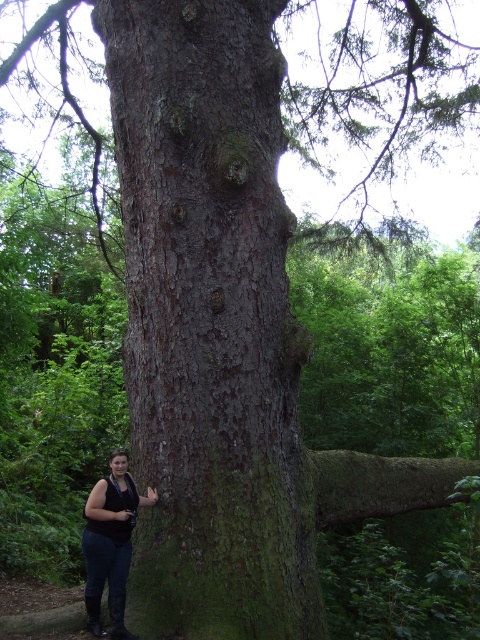
Question: Does dark brown rough bark at center lie in front of matte black vest at lower left?

Choices:
 (A) yes
 (B) no

Answer: (A)

Question: Can you confirm if dark brown rough bark at center is wider than matte black vest at lower left?

Choices:
 (A) yes
 (B) no

Answer: (A)

Question: Which object appears farthest from the camera in this image?

Choices:
 (A) matte black vest at lower left
 (B) dark brown rough bark at center

Answer: (A)

Question: Does dark brown rough bark at center have a greater width compared to matte black vest at lower left?

Choices:
 (A) yes
 (B) no

Answer: (A)